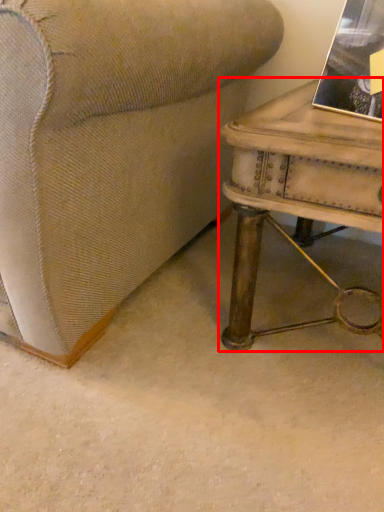
Question: Considering the relative positions of table (annotated by the red box) and book in the image provided, where is table (annotated by the red box) located with respect to the staircase?

Choices:
 (A) right
 (B) left

Answer: (B)